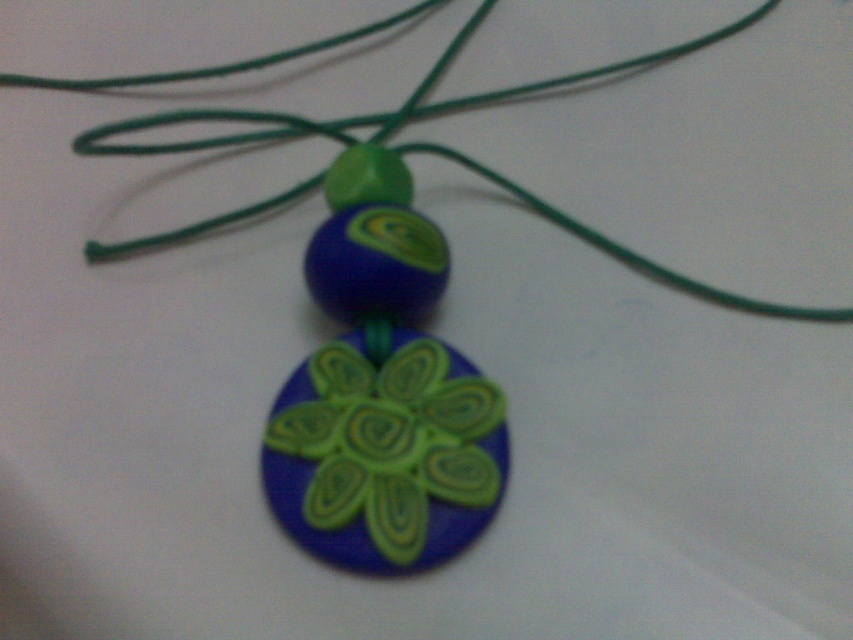
Question: Among these objects, which one is nearest to the camera?

Choices:
 (A) matte green clay flower at center
 (B) green cord at center

Answer: (A)

Question: Where is matte green clay flower at center located in relation to green cord at center in the image?

Choices:
 (A) right
 (B) left

Answer: (B)

Question: Does matte green clay flower at center have a smaller size compared to green cord at center?

Choices:
 (A) no
 (B) yes

Answer: (B)

Question: Which point is closer to the camera taking this photo?

Choices:
 (A) tap(788, 310)
 (B) tap(350, 440)

Answer: (B)

Question: Is the position of matte green clay flower at center less distant than that of green cord at center?

Choices:
 (A) yes
 (B) no

Answer: (A)